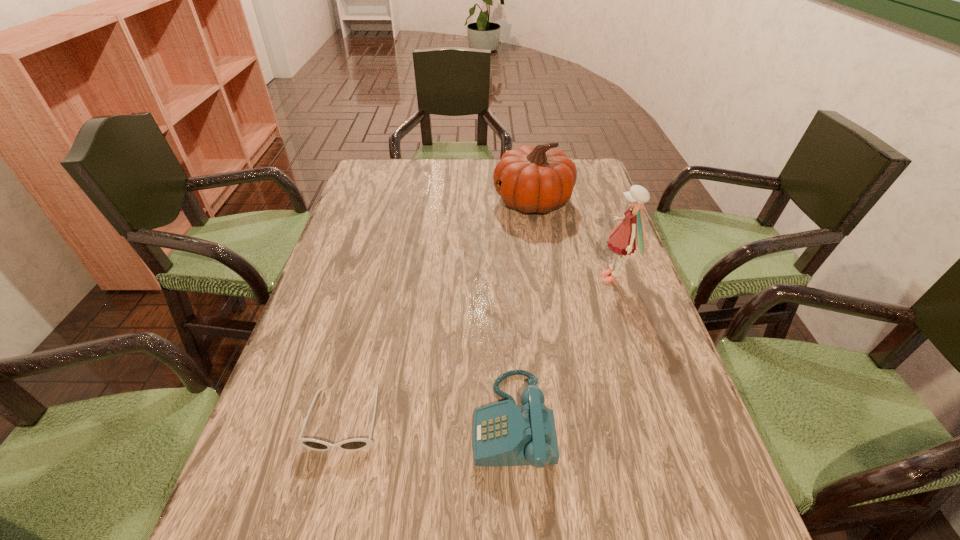
Locate an element on the screen. This screenshot has width=960, height=540. unoccupied area between the pumpkin and the shortest object is located at coordinates (439, 310).

What are the coordinates of `unoccupied area between the farthest object and the second shortest object` in the screenshot? It's located at (522, 312).

This screenshot has height=540, width=960. I want to click on free space that is in between the doll and the sunglasses, so (x=479, y=349).

Find the location of `free spot between the shortest object and the tallest object`. free spot between the shortest object and the tallest object is located at coordinates (479, 349).

Image resolution: width=960 pixels, height=540 pixels. In order to click on blank region between the pumpkin and the shortest object in this screenshot , I will do point(439,310).

Locate an element on the screen. This screenshot has width=960, height=540. vacant space that's between the third tallest object and the doll is located at coordinates 564,350.

Find the location of a particular element. Image resolution: width=960 pixels, height=540 pixels. free space between the doll and the shortest object is located at coordinates (479, 349).

Locate an element on the screen. The height and width of the screenshot is (540, 960). the third closest object to the second shortest object is located at coordinates (538, 179).

Locate which object is the closest to the third nearest object. Please provide its 2D coordinates. Your answer should be formatted as a tuple, i.e. [(x, y)], where the tuple contains the x and y coordinates of a point satisfying the conditions above.

[(538, 179)]

Locate an element on the screen. This screenshot has height=540, width=960. free space in the image that satisfies the following two spatial constraints: 1. on the front-facing side of the doll; 2. with the lenses of the shortest object facing outward is located at coordinates (660, 420).